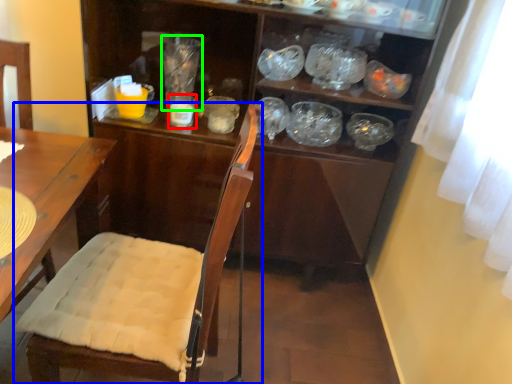
Question: Considering the real-world distances, which object is closest to tableware (highlighted by a red box)? chair (highlighted by a blue box) or glass jar (highlighted by a green box).

Choices:
 (A) chair
 (B) glass jar

Answer: (B)